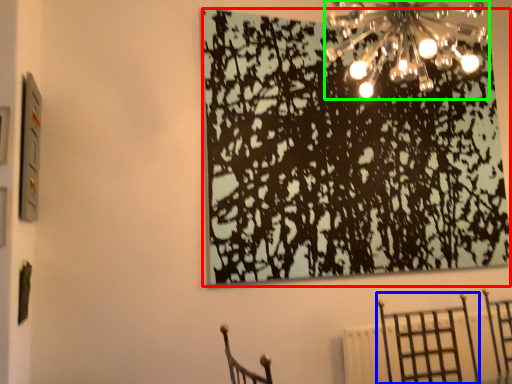
Question: Which object is positioned closest to tree (highlighted by a red box)? Select from furniture (highlighted by a blue box) and lamp (highlighted by a green box).

Choices:
 (A) furniture
 (B) lamp

Answer: (B)